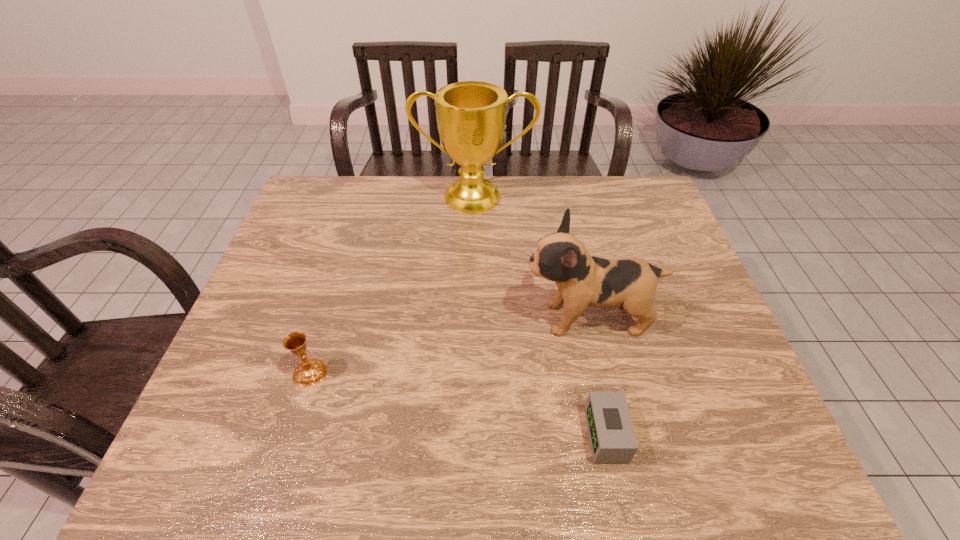
The image size is (960, 540). Identify the location of the farthest object. (471, 115).

Find the location of a particular element. Image resolution: width=960 pixels, height=540 pixels. the tallest object is located at coordinates (471, 115).

Locate an element on the screen. This screenshot has width=960, height=540. the third nearest object is located at coordinates (582, 280).

This screenshot has width=960, height=540. Find the location of `puppy`. puppy is located at coordinates (582, 280).

Locate an element on the screen. The width and height of the screenshot is (960, 540). the second nearest object is located at coordinates (312, 371).

The image size is (960, 540). In order to click on the third tallest object in this screenshot , I will do `click(312, 371)`.

At what (x,y) coordinates should I click in order to perform the action: click on the shortest object. Please return your answer as a coordinate pair (x, y). Image resolution: width=960 pixels, height=540 pixels. Looking at the image, I should click on (612, 438).

I want to click on the nearest object, so click(x=612, y=438).

This screenshot has width=960, height=540. I want to click on free spot located on the shiny surface of the tallest object, so click(473, 230).

You are a GUI agent. You are given a task and a screenshot of the screen. Output one action in this format:
    pyautogui.click(x=<x>, y=<y>)
    Task: Click on the vacant position located at the face of the second tallest object
    Image resolution: width=960 pixels, height=540 pixels.
    Given the screenshot: What is the action you would take?
    pyautogui.click(x=446, y=319)